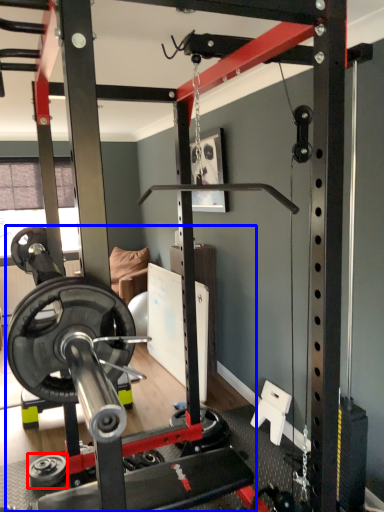
Question: Which object appears farthest to the camera in this image, wheel (highlighted by a red box) or barbell (highlighted by a blue box)?

Choices:
 (A) wheel
 (B) barbell

Answer: (A)